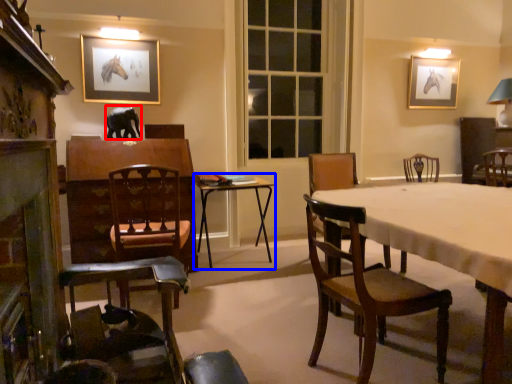
Question: Which of the following is the closest to the observer, animal (highlighted by a red box) or table (highlighted by a blue box)?

Choices:
 (A) animal
 (B) table

Answer: (B)